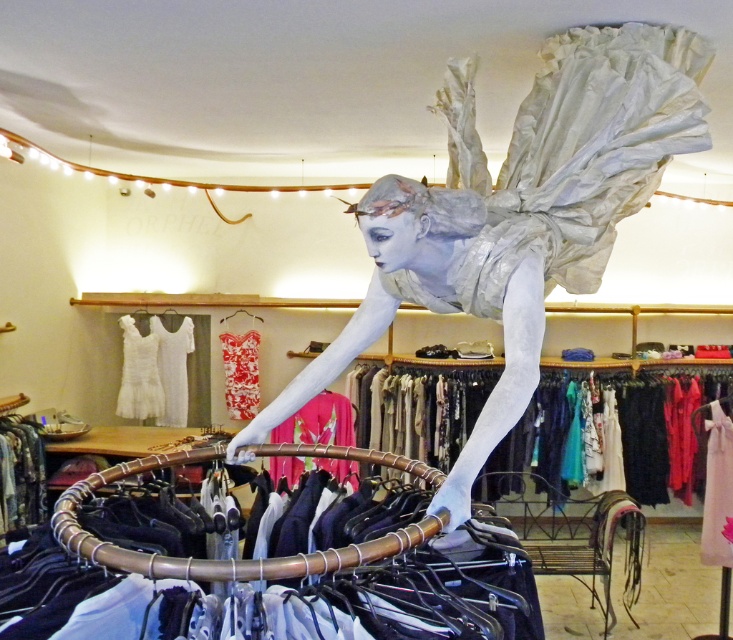
From the picture: You are a customer in the clothing store and you want to try on both the floral fabric dress at lower left and the white lace dress at left. However, the changing room is small and can only accommodate one dress at a time. Which dress should you put into the changing room first if you want to start with the bigger one?

You should start with the floral fabric dress at lower left since it has a larger size compared to the white lace dress at left.

You are a customer in the clothing store and want to try on both the floral fabric dress at lower left and the white lace dress at left. If you have a narrow closet space, which dress should you choose to ensure it fits without needing to fold it?

The floral fabric dress at lower left has a smaller width than the white lace dress at left, so it would fit better in a narrow closet space without needing to fold it.

You are a customer in the clothing store and want to see both the floral fabric dress at lower left and the white lace dress at left. Which dress is shorter in height?

The floral fabric dress at lower left has a lesser height compared to the white lace dress at left, so the floral fabric dress at lower left is shorter in height.